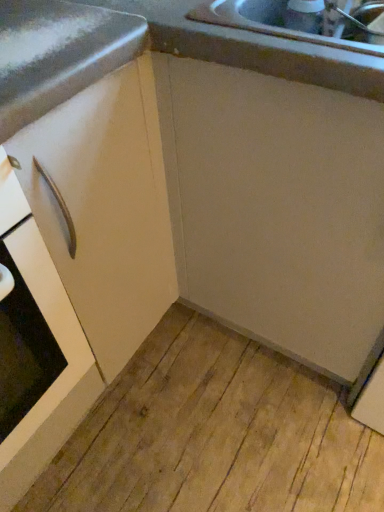
Question: Would you say white matte cabinet handle at left is to the left or to the right of matte white cabinet at center in the picture?

Choices:
 (A) right
 (B) left

Answer: (B)

Question: Is white matte cabinet handle at left inside or outside of matte white cabinet at center?

Choices:
 (A) inside
 (B) outside

Answer: (B)

Question: In the image, is white matte cabinet handle at left positioned in front of or behind matte white cabinet at center?

Choices:
 (A) behind
 (B) front

Answer: (B)

Question: Considering the positions of point (140, 228) and point (39, 298), is point (140, 228) closer or farther from the camera than point (39, 298)?

Choices:
 (A) farther
 (B) closer

Answer: (A)

Question: Based on their positions, is matte white cabinet at center located to the left or right of white matte cabinet handle at left?

Choices:
 (A) left
 (B) right

Answer: (B)

Question: In terms of size, does matte white cabinet at center appear bigger or smaller than white matte cabinet handle at left?

Choices:
 (A) big
 (B) small

Answer: (A)

Question: In terms of height, does matte white cabinet at center look taller or shorter compared to white matte cabinet handle at left?

Choices:
 (A) short
 (B) tall

Answer: (B)